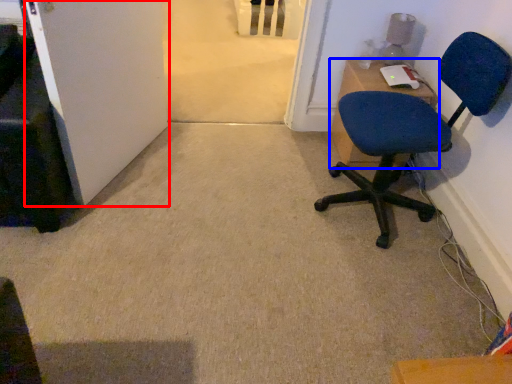
Question: Which object appears closest to the camera in this image, door (highlighted by a red box) or desk (highlighted by a blue box)?

Choices:
 (A) door
 (B) desk

Answer: (A)